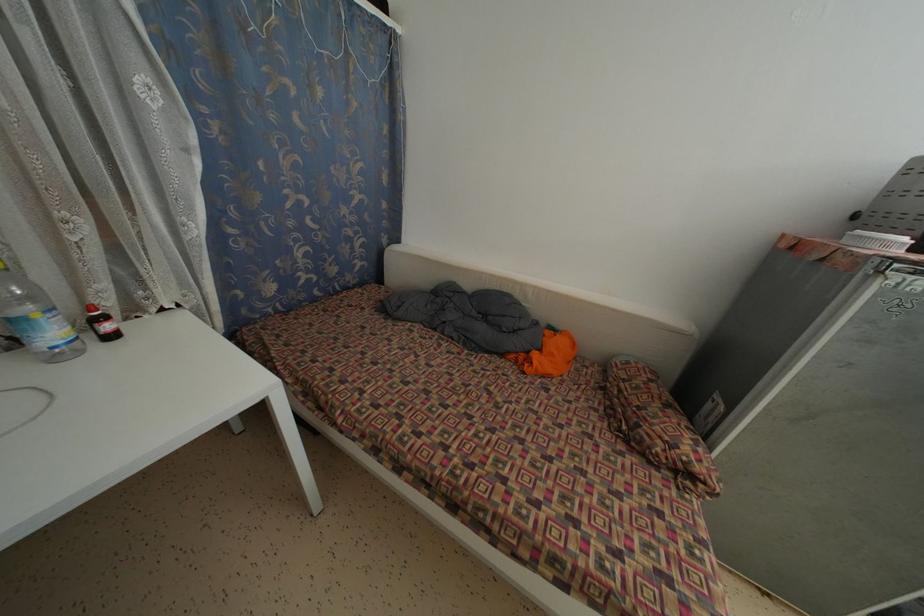
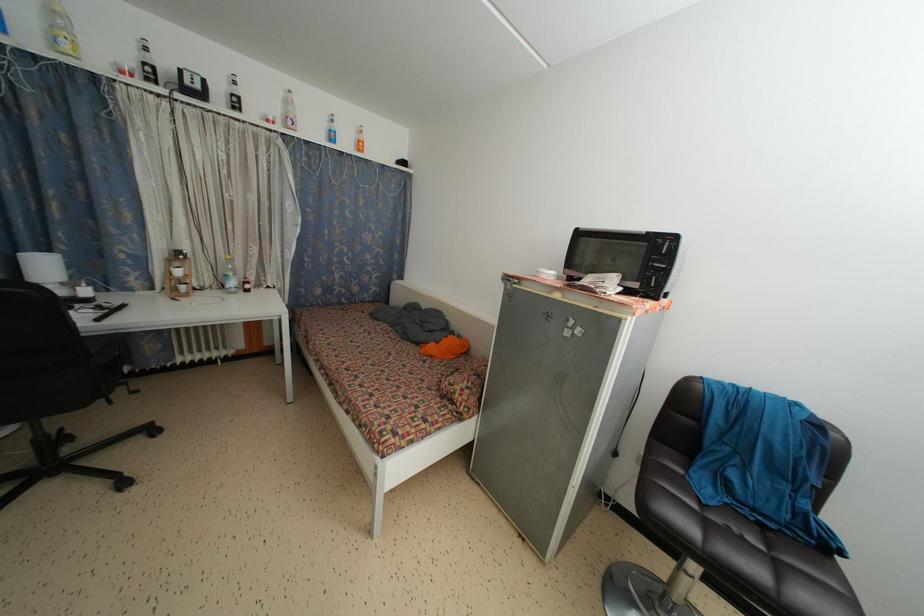
Find the pixel in the second image that matches (x=494, y=398) in the first image.

(394, 360)